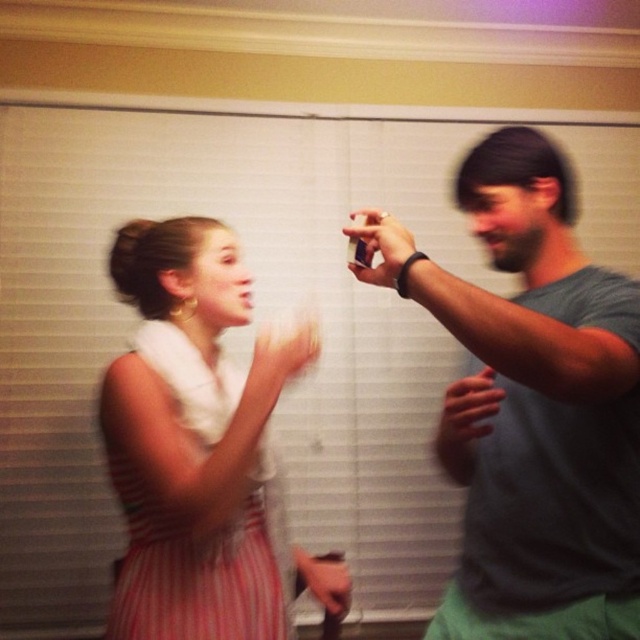
Question: Is gray matte t-shirt at upper right smaller than white fabric towel at left?

Choices:
 (A) yes
 (B) no

Answer: (B)

Question: Among these points, which one is nearest to the camera?

Choices:
 (A) (467, 333)
 (B) (264, 333)

Answer: (A)

Question: Does gray matte t-shirt at upper right have a smaller size compared to white fabric towel at left?

Choices:
 (A) yes
 (B) no

Answer: (B)

Question: Which point is farther to the camera?

Choices:
 (A) gray matte t-shirt at upper right
 (B) white fabric towel at left

Answer: (B)

Question: Is the position of gray matte t-shirt at upper right less distant than that of white fabric towel at left?

Choices:
 (A) yes
 (B) no

Answer: (A)